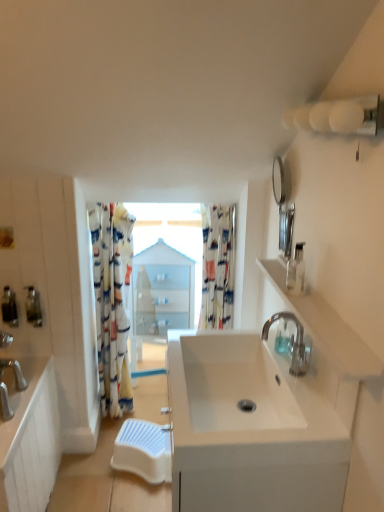
What do you see at coordinates (143, 450) in the screenshot? I see `white plastic step stool at lower center` at bounding box center [143, 450].

Find the location of a particular element. The height and width of the screenshot is (512, 384). printed fabric shower curtain at left, the first shower curtain when ordered from left to right is located at coordinates (112, 303).

Describe the element at coordinates (9, 307) in the screenshot. I see `matte silver soap dispenser at left, which appears as the second soap dispenser when viewed from the front` at that location.

What do you see at coordinates (291, 342) in the screenshot? I see `polished chrome faucet at center right` at bounding box center [291, 342].

The width and height of the screenshot is (384, 512). Describe the element at coordinates (255, 426) in the screenshot. I see `white ceramic sink at center` at that location.

Locate an element on the screen. The width and height of the screenshot is (384, 512). satin nickel cabinet at left is located at coordinates (30, 439).

Is point (300, 250) in front of point (212, 222)?

Yes, point (300, 250) is closer to viewer.

Which is correct: clear plastic soap dispenser at upper right, positioned as the third soap dispenser in left-to-right order, is inside printed fabric shower curtain at center, which is counted as the second shower curtain, starting from the left, or outside of it?

clear plastic soap dispenser at upper right, positioned as the third soap dispenser in left-to-right order, exists outside the volume of printed fabric shower curtain at center, which is counted as the second shower curtain, starting from the left.

Is the depth of clear plastic soap dispenser at upper right, the first soap dispenser in the right-to-left sequence, less than that of printed fabric shower curtain at center, which is counted as the second shower curtain, starting from the left?

Yes.

From the image's perspective, between clear plastic soap dispenser at upper right, placed as the 3th soap dispenser when sorted from back to front, and printed fabric shower curtain at center, which is counted as the second shower curtain, starting from the left, who is located below?

printed fabric shower curtain at center, which is counted as the second shower curtain, starting from the left, is shown below in the image.

From a real-world perspective, relative to white ceramic sink at center, is printed fabric shower curtain at center, acting as the first shower curtain starting from the right, vertically above or below?

Clearly, from a real-world perspective, printed fabric shower curtain at center, acting as the first shower curtain starting from the right, is above white ceramic sink at center.

Find the location of a particular element. sink on the right of the printed fabric shower curtain at center, which is counted as the second shower curtain, starting from the left is located at coordinates (255, 426).

Is point (233, 226) more distant than point (314, 371)?

Yes, it is.

Is printed fabric shower curtain at center, acting as the first shower curtain starting from the right, at the left side of white ceramic sink at center?

Yes, printed fabric shower curtain at center, acting as the first shower curtain starting from the right, is to the left of white ceramic sink at center.

Considering the positions of objects matte silver soap dispenser at left, which appears as the second soap dispenser when viewed from the front, and satin nickel cabinet at left in the image provided, who is more to the right, matte silver soap dispenser at left, which appears as the second soap dispenser when viewed from the front, or satin nickel cabinet at left?

Positioned to the right is satin nickel cabinet at left.

You are a GUI agent. You are given a task and a screenshot of the screen. Output one action in this format:
    pyautogui.click(x=<x>, y=<y>)
    Task: Click on the bathroom cabinet below the matte silver soap dispenser at left, which is the 2th soap dispenser in back-to-front order (from the image's perspective)
    
    Given the screenshot: What is the action you would take?
    pyautogui.click(x=30, y=439)

Is point (10, 313) more distant than point (41, 443)?

That is True.

Is matte silver soap dispenser at left, which is the first soap dispenser in left-to-right order, bigger than satin nickel cabinet at left?

No.

Would you consider printed fabric shower curtain at center, which is counted as the second shower curtain, starting from the left, to be distant from white glossy sink at right?

Actually, printed fabric shower curtain at center, which is counted as the second shower curtain, starting from the left, and white glossy sink at right are a little close together.

Is printed fabric shower curtain at center, acting as the first shower curtain starting from the right, wider or thinner than white glossy sink at right?

In the image, printed fabric shower curtain at center, acting as the first shower curtain starting from the right, appears to be wider than white glossy sink at right.

From the picture: Between printed fabric shower curtain at center, which is counted as the second shower curtain, starting from the left, and white glossy sink at right, which one has larger size?

printed fabric shower curtain at center, which is counted as the second shower curtain, starting from the left, is bigger.

From the picture: Is printed fabric shower curtain at center, which is counted as the second shower curtain, starting from the left, facing towards white glossy sink at right?

Yes.

Consider the image. From the image's perspective, is white plastic step stool at lower center located above matte silver soap dispenser at left, which is the 2th soap dispenser in back-to-front order?

No.

Is white plastic step stool at lower center far from matte silver soap dispenser at left, which is the first soap dispenser in left-to-right order?

No.

Who is bigger, white plastic step stool at lower center or matte silver soap dispenser at left, positioned as the 3th soap dispenser in right-to-left order?

With larger size is white plastic step stool at lower center.

Measure the distance from white plastic step stool at lower center to matte silver soap dispenser at left, positioned as the 3th soap dispenser in right-to-left order.

white plastic step stool at lower center is 85.18 centimeters away from matte silver soap dispenser at left, positioned as the 3th soap dispenser in right-to-left order.

How different are the orientations of white glossy medicine cabinet at center and printed fabric shower curtain at left, the first shower curtain when ordered from left to right, in degrees?

The angular difference between white glossy medicine cabinet at center and printed fabric shower curtain at left, the first shower curtain when ordered from left to right, is 3.32 degrees.

Considering the sizes of objects white glossy medicine cabinet at center and printed fabric shower curtain at left, placed as the second shower curtain when sorted from right to left, in the image provided, who is taller, white glossy medicine cabinet at center or printed fabric shower curtain at left, placed as the second shower curtain when sorted from right to left,?

With more height is printed fabric shower curtain at left, placed as the second shower curtain when sorted from right to left.

Considering the relative sizes of white glossy medicine cabinet at center and printed fabric shower curtain at left, the first shower curtain when ordered from left to right, in the image provided, is white glossy medicine cabinet at center bigger than printed fabric shower curtain at left, the first shower curtain when ordered from left to right,?

Yes.

In the image, is polished chrome faucet at center right positioned in front of or behind white glossy medicine cabinet at center?

In the image, polished chrome faucet at center right appears in front of white glossy medicine cabinet at center.

Between polished chrome faucet at center right and white glossy medicine cabinet at center, which one appears on the right side from the viewer's perspective?

polished chrome faucet at center right is more to the right.

Where is `medicine cabinet on the left side of polished chrome faucet at center right`? The image size is (384, 512). medicine cabinet on the left side of polished chrome faucet at center right is located at coordinates (162, 290).

From a real-world perspective, is polished chrome faucet at center right below white glossy medicine cabinet at center?

No.

Identify the location of soap dispenser that is the 3rd one when counting forward from the printed fabric shower curtain at center, which is counted as the second shower curtain, starting from the left. This screenshot has width=384, height=512. (296, 271).

The image size is (384, 512). What are the coordinates of `the 2nd shower curtain above the white ceramic sink at center (from the image's perspective)` in the screenshot? It's located at (218, 266).

Looking at this image, estimate the real-world distances between objects in this image. Which object is closer to white ceramic sink at center, matte silver soap dispenser at left, positioned as the 3th soap dispenser in right-to-left order, or printed fabric shower curtain at left, the first shower curtain when ordered from left to right?

The object closer to white ceramic sink at center is printed fabric shower curtain at left, the first shower curtain when ordered from left to right.

Looking at this image, based on their spatial positions, is translucent plastic soap dispenser at left, which is counted as the 1th soap dispenser, starting from the back, or white ceramic sink at center further from white plastic step stool at lower center?

white ceramic sink at center is further to white plastic step stool at lower center.

Estimate the real-world distances between objects in this image. Which object is closer to matte silver soap dispenser at left, which is the 2th soap dispenser in back-to-front order, white glossy sink at right or translucent plastic soap dispenser at left, which is counted as the 1th soap dispenser, starting from the back?

The object closer to matte silver soap dispenser at left, which is the 2th soap dispenser in back-to-front order, is translucent plastic soap dispenser at left, which is counted as the 1th soap dispenser, starting from the back.

From the image, which object appears to be farther from printed fabric shower curtain at left, placed as the second shower curtain when sorted from right to left, polished chrome faucet at center right or white glossy sink at right?

The object further to printed fabric shower curtain at left, placed as the second shower curtain when sorted from right to left, is polished chrome faucet at center right.

Based on their spatial positions, is printed fabric shower curtain at center, acting as the first shower curtain starting from the right, or white glossy sink at right further from white plastic step stool at lower center?

white glossy sink at right is positioned further to the anchor white plastic step stool at lower center.

When comparing their distances from white plastic step stool at lower center, does translucent plastic soap dispenser at left, which is the 3th soap dispenser from front to back, or polished chrome faucet at center right seem further?

Based on the image, polished chrome faucet at center right appears to be further to white plastic step stool at lower center.

Which object lies nearer to the anchor point white ceramic sink at center, printed fabric shower curtain at left, placed as the second shower curtain when sorted from right to left, or satin nickel cabinet at left?

satin nickel cabinet at left is positioned closer to the anchor white ceramic sink at center.

Based on their spatial positions, is matte silver soap dispenser at left, which appears as the second soap dispenser when viewed from the front, or white ceramic sink at center closer to clear plastic soap dispenser at upper right, placed as the 3th soap dispenser when sorted from back to front?

Based on the image, white ceramic sink at center appears to be nearer to clear plastic soap dispenser at upper right, placed as the 3th soap dispenser when sorted from back to front.

The height and width of the screenshot is (512, 384). In order to click on bathroom cabinet between white ceramic sink at center and white glossy medicine cabinet at center in the front-back direction in this screenshot , I will do `click(30, 439)`.

The height and width of the screenshot is (512, 384). I want to click on bathroom cabinet between matte silver soap dispenser at left, which is the first soap dispenser in left-to-right order, and white plastic step stool at lower center from top to bottom, so click(x=30, y=439).

You are a GUI agent. You are given a task and a screenshot of the screen. Output one action in this format:
    pyautogui.click(x=<x>, y=<y>)
    Task: Click on the sink between matte silver soap dispenser at left, positioned as the 3th soap dispenser in right-to-left order, and polished chrome faucet at center right, in the horizontal direction
    The width and height of the screenshot is (384, 512).
    Given the screenshot: What is the action you would take?
    pyautogui.click(x=255, y=426)

Find the location of a particular element. This screenshot has height=512, width=384. bathroom cabinet positioned between clear plastic soap dispenser at upper right, the first soap dispenser positioned from the front, and white glossy medicine cabinet at center from near to far is located at coordinates (30, 439).